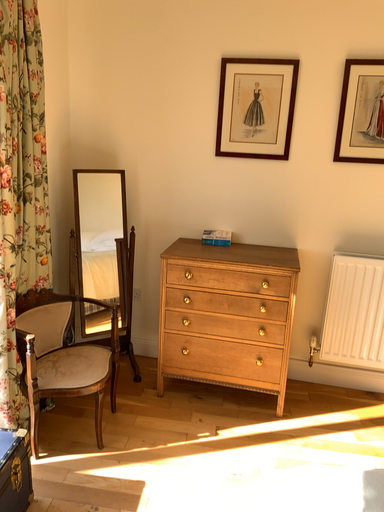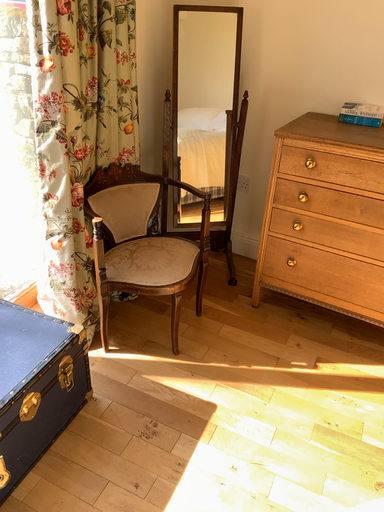
Question: Which way did the camera rotate in the video?

Choices:
 (A) rotated upward
 (B) rotated downward

Answer: (B)